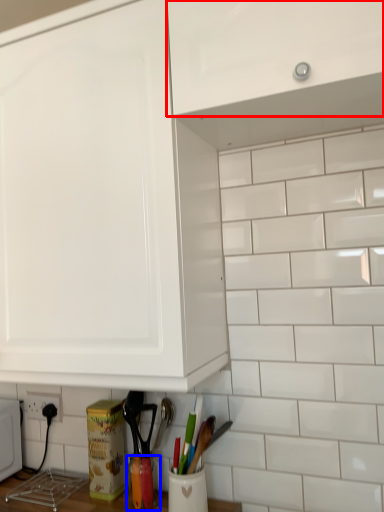
Question: Which object is further to the camera taking this photo, cabinetry (highlighted by a red box) or appliance (highlighted by a blue box)?

Choices:
 (A) cabinetry
 (B) appliance

Answer: (B)